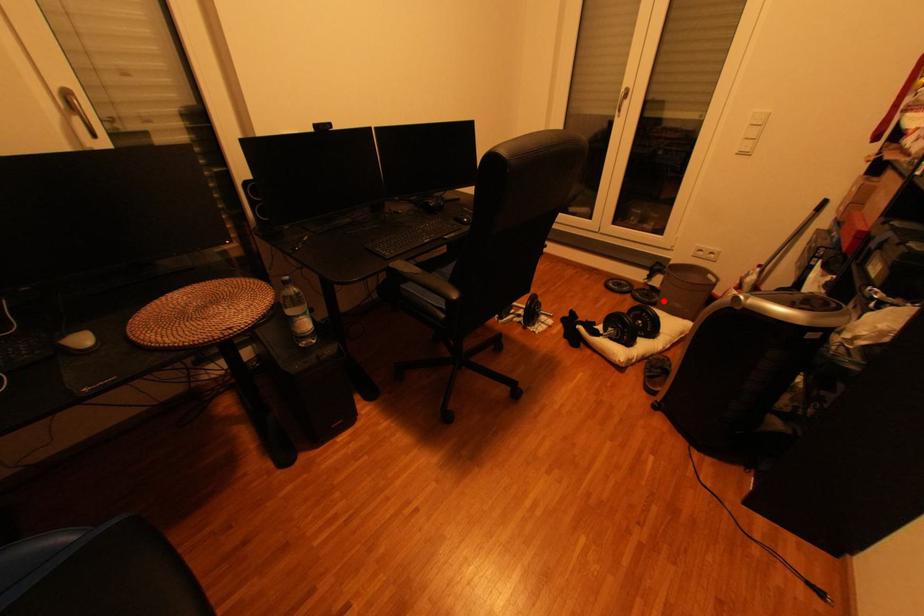
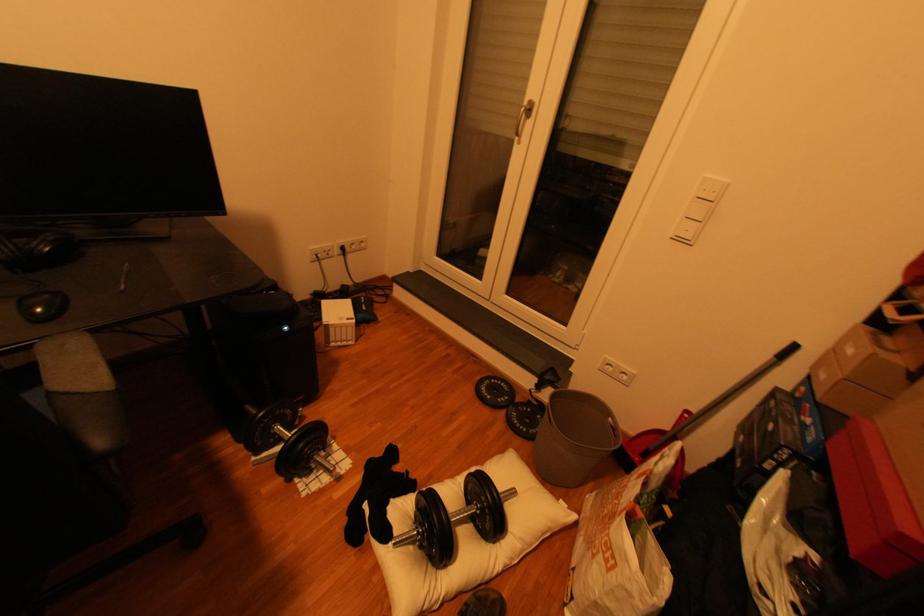
Question: I am providing you with two images of the same scene from different viewpoints. A red point is shown in image1. For the corresponding object point in image2, is it positioned nearer or farther from the camera?

Choices:
 (A) Nearer
 (B) Farther

Answer: (A)